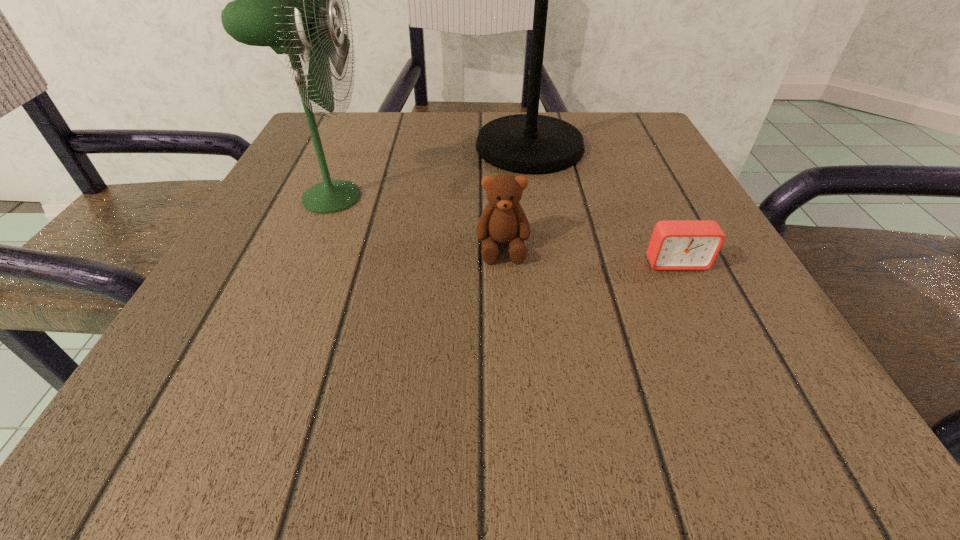
You are a GUI agent. You are given a task and a screenshot of the screen. Output one action in this format:
    pyautogui.click(x=<x>, y=<y>)
    Task: Click on the table lamp present at the far edge
    This screenshot has height=540, width=960.
    Given the screenshot: What is the action you would take?
    pyautogui.click(x=529, y=143)

The image size is (960, 540). Find the location of `fan at the far edge`. fan at the far edge is located at coordinates (283, 0).

The height and width of the screenshot is (540, 960). In order to click on object at the left edge in this screenshot , I will do `click(283, 0)`.

Locate an element on the screen. This screenshot has width=960, height=540. table lamp that is at the right edge is located at coordinates (529, 143).

Locate an element on the screen. alarm clock present at the right edge is located at coordinates (675, 244).

Where is `object situated at the far left corner`? object situated at the far left corner is located at coordinates [x=283, y=0].

In order to click on object positioned at the far right corner in this screenshot , I will do click(x=529, y=143).

In order to click on free space at the far edge of the desktop in this screenshot , I will do `click(457, 163)`.

Where is `free space at the near edge of the desktop`? free space at the near edge of the desktop is located at coordinates (569, 389).

At what (x,y) coordinates should I click in order to perform the action: click on vacant space at the left edge. Please return your answer as a coordinate pair (x, y). This screenshot has height=540, width=960. Looking at the image, I should click on (340, 217).